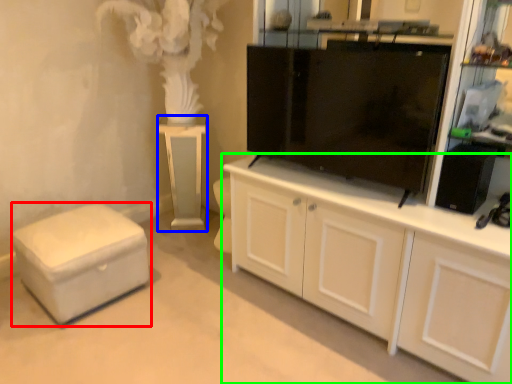
Question: Which object is positioned farthest from furniture (highlighted by a red box)? Select from table (highlighted by a blue box) and cabinetry (highlighted by a green box).

Choices:
 (A) table
 (B) cabinetry

Answer: (B)